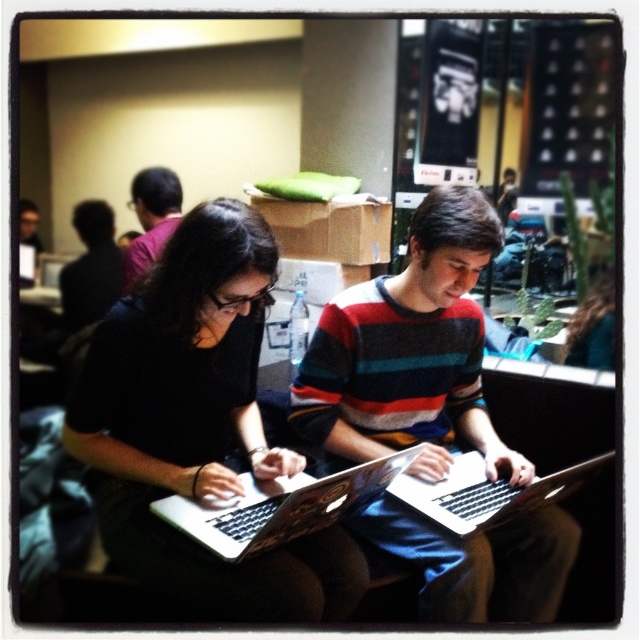
You are trying to place both the black matte laptop at center and the metallic silver laptop at center side by side on a desk. Based on the image, which laptop should be placed first to ensure they fit properly?

The metallic silver laptop at center should be placed first since the black matte laptop at center might be wider, allowing more space for it next to the metallic one.

You are a delivery person who needs to place a small package on the table between the two people. The package must be placed exactly at the coordinates point (198, 426). Can you confirm if this location is clear of any objects?

The point (198, 426) corresponds to the black matte laptop at center, so placing the package there would cover the laptop. Choose another spot.

You are a photographer trying to capture a candid shot of both the striped knit sweater at center and the matte black shirt at left. Since you want to ensure both are visible in the frame, which one should you focus on first to avoid missing either in your shot?

The striped knit sweater at center is positioned under the matte black shirt at left, so you should focus on the matte black shirt at left first to ensure it stays in the frame while capturing the lower positioned striped knit sweater at center.